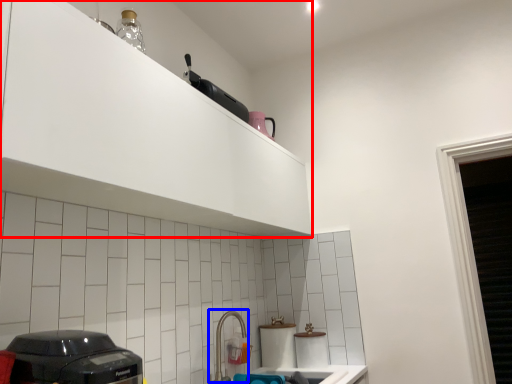
Question: Among these objects, which one is farthest to the camera, cabinetry (highlighted by a red box) or faucet (highlighted by a blue box)?

Choices:
 (A) cabinetry
 (B) faucet

Answer: (B)